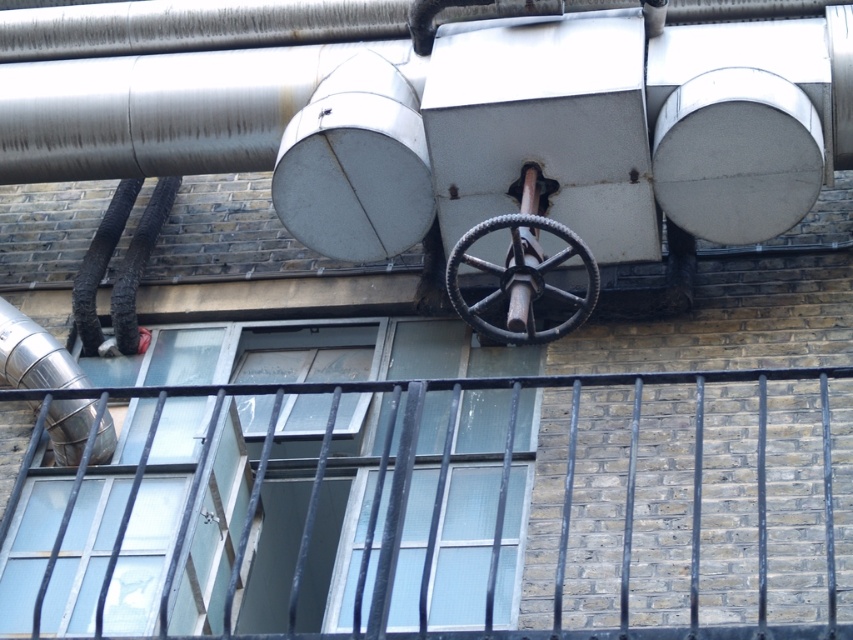
Question: Does black metal railing at center lie behind brushed metal water pipe at left?

Choices:
 (A) yes
 (B) no

Answer: (B)

Question: Is black metal railing at center smaller than rubber textured wheel at center?

Choices:
 (A) no
 (B) yes

Answer: (A)

Question: Can you confirm if rubber textured wheel at center is positioned to the left of brushed metal water pipe at left?

Choices:
 (A) yes
 (B) no

Answer: (B)

Question: Among these points, which one is farthest from the camera?

Choices:
 (A) (695, 467)
 (B) (496, 275)
 (C) (55, 456)

Answer: (C)

Question: Which object appears closest to the camera in this image?

Choices:
 (A) black metal railing at center
 (B) brushed metal water pipe at left

Answer: (A)

Question: Which point appears closest to the camera in this image?

Choices:
 (A) (558, 541)
 (B) (454, 296)
 (C) (80, 440)

Answer: (A)